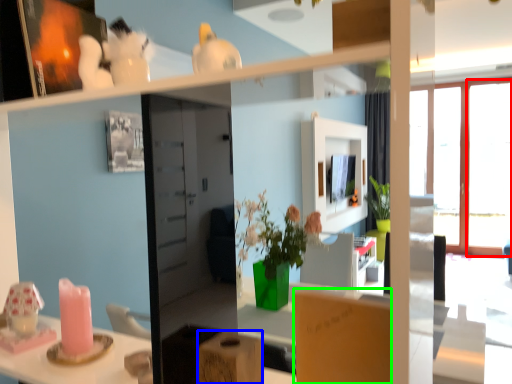
Question: Which object is positioned closest to window (highlighted by a red box)? Select from cardboard box (highlighted by a blue box) and cardboard box (highlighted by a green box).

Choices:
 (A) cardboard box
 (B) cardboard box

Answer: (B)